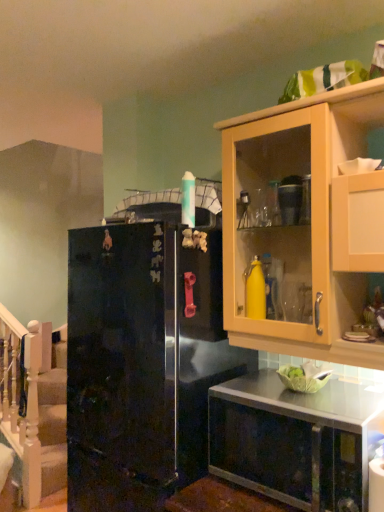
Question: Can you confirm if light wood cabinet at upper right is thinner than glossy black refrigerator at left?

Choices:
 (A) yes
 (B) no

Answer: (A)

Question: From a real-world perspective, does light wood cabinet at upper right sit lower than glossy black refrigerator at left?

Choices:
 (A) yes
 (B) no

Answer: (B)

Question: Would you say glossy black refrigerator at left is part of light wood cabinet at upper right's contents?

Choices:
 (A) no
 (B) yes

Answer: (A)

Question: Is light wood cabinet at upper right oriented towards glossy black refrigerator at left?

Choices:
 (A) no
 (B) yes

Answer: (A)

Question: From a real-world perspective, is light wood cabinet at upper right on top of glossy black refrigerator at left?

Choices:
 (A) no
 (B) yes

Answer: (B)

Question: Considering the positions of glossy black refrigerator at left and light wood cabinet at upper right in the image, is glossy black refrigerator at left taller or shorter than light wood cabinet at upper right?

Choices:
 (A) short
 (B) tall

Answer: (B)

Question: From a real-world perspective, is glossy black refrigerator at left above or below light wood cabinet at upper right?

Choices:
 (A) above
 (B) below

Answer: (B)

Question: Looking at the image, does glossy black refrigerator at left seem bigger or smaller compared to light wood cabinet at upper right?

Choices:
 (A) big
 (B) small

Answer: (A)

Question: Relative to light wood cabinet at upper right, is glossy black refrigerator at left in front or behind?

Choices:
 (A) behind
 (B) front

Answer: (A)

Question: From the image's perspective, is glossy black refrigerator at left located above or below white wooden staircase at left?

Choices:
 (A) below
 (B) above

Answer: (B)

Question: Looking at their shapes, would you say glossy black refrigerator at left is wider or thinner than white wooden staircase at left?

Choices:
 (A) thin
 (B) wide

Answer: (B)

Question: Do you think glossy black refrigerator at left is within white wooden staircase at left, or outside of it?

Choices:
 (A) outside
 (B) inside

Answer: (A)

Question: In terms of size, does glossy black refrigerator at left appear bigger or smaller than white wooden staircase at left?

Choices:
 (A) big
 (B) small

Answer: (A)

Question: Is light wood cabinet at upper right spatially inside glossy black refrigerator at left, or outside of it?

Choices:
 (A) inside
 (B) outside

Answer: (B)

Question: Based on their sizes in the image, would you say light wood cabinet at upper right is bigger or smaller than glossy black refrigerator at left?

Choices:
 (A) big
 (B) small

Answer: (B)